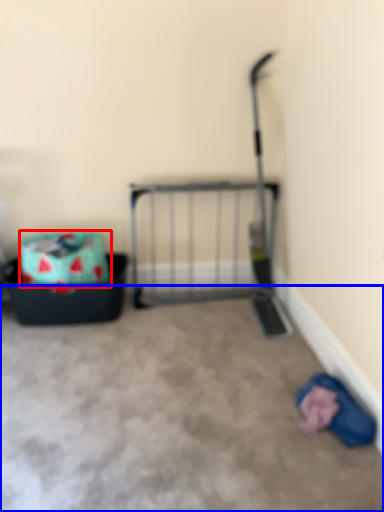
Question: Which object is closer to the camera taking this photo, storage box (highlighted by a red box) or concrete (highlighted by a blue box)?

Choices:
 (A) storage box
 (B) concrete

Answer: (B)